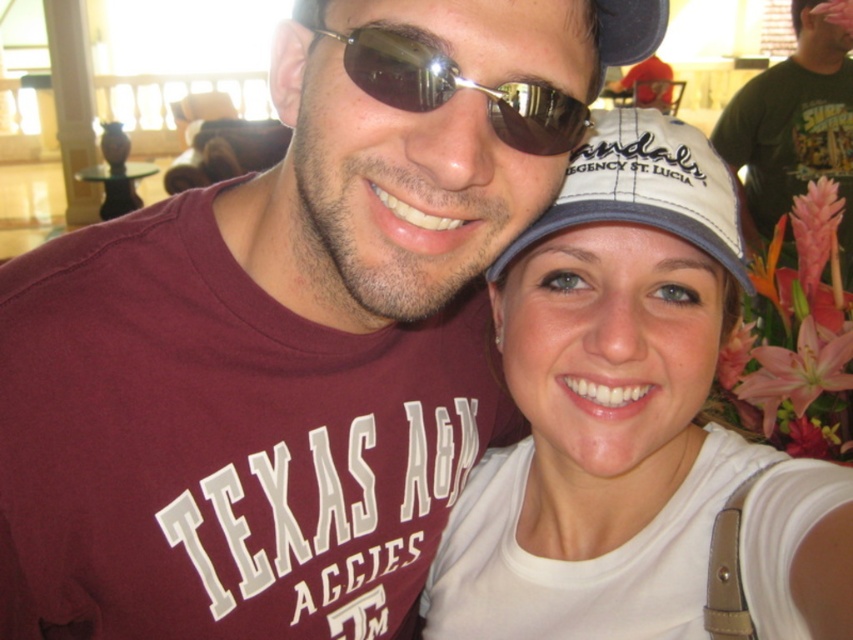
You are a photographer trying to capture a clear shot of both the white fabric baseball cap at center and the sunglasses at center. Given that your camera has a depth of field that can sharply focus on objects within a 5 inch range, will both items be in focus?

The distance between the white fabric baseball cap at center and sunglasses at center is 5.13 inches, which exceeds the camera sensor depth of field range of 5 inches. Therefore, both items cannot be in focus simultaneously.

You are a photographer trying to adjust the focus on your camera. You have two points to focus on in the image, point (585, 106) and point (648, 29). Which point should you focus on if you want to capture the person closest to the camera more clearly?

Point (585, 106) is closer to the camera than point (648, 29), so you should focus on point (585, 106) to capture the person closest to the camera more clearly.

Based on the photo, you are a photographer standing 1 meter away from the white fabric baseball cap at center. Can you reach out and touch it without moving your feet?

The white fabric baseball cap at center is 69.17 centimeters away from the viewer. Since you are standing 1 meter away, which is farther than the distance to the cap, you cannot reach it without moving closer.